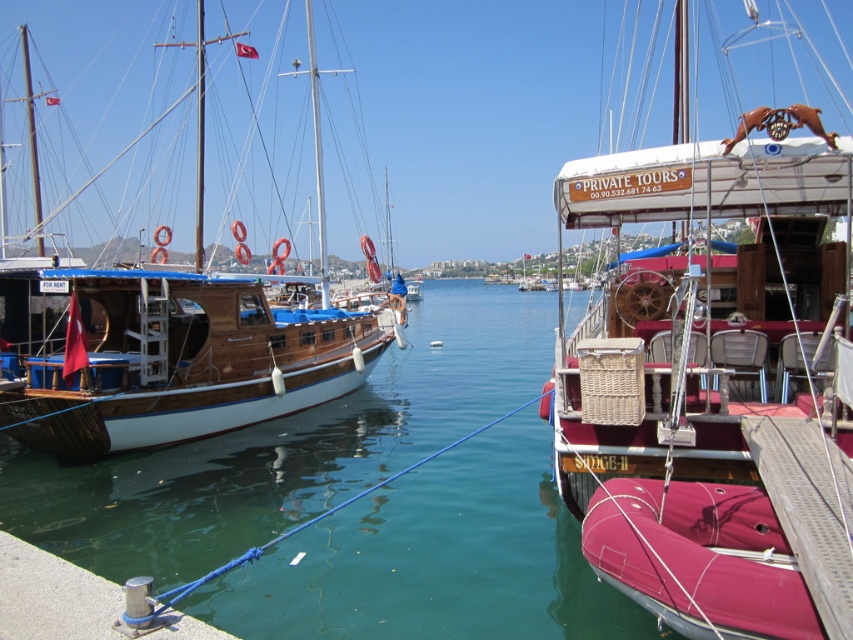
Between wooden sailboat at center and green water at center, which one has less height?

With less height is green water at center.

Does wooden sailboat at center appear under green water at center?

Actually, wooden sailboat at center is above green water at center.

The width and height of the screenshot is (853, 640). Describe the element at coordinates (714, 378) in the screenshot. I see `wooden sailboat at center` at that location.

The height and width of the screenshot is (640, 853). I want to click on wooden sailboat at center, so click(714, 378).

How much distance is there between wooden sailboat at center and wooden sailboat at left?

wooden sailboat at center and wooden sailboat at left are 8.52 meters apart from each other.

Find the location of a particular element. wooden sailboat at center is located at coordinates (714, 378).

Which is behind, point (828, 387) or point (206, 316)?

Point (206, 316)

At what (x,y) coordinates should I click in order to perform the action: click on wooden sailboat at center. Please return your answer as a coordinate pair (x, y). Image resolution: width=853 pixels, height=640 pixels. Looking at the image, I should click on (714, 378).

Is green water at center positioned behind wooden sailboat at left?

No, it is in front of wooden sailboat at left.

Is green water at center above wooden sailboat at left?

Incorrect, green water at center is not positioned above wooden sailboat at left.

Is point (463, 428) more distant than point (204, 369)?

Yes, point (463, 428) is behind point (204, 369).

The height and width of the screenshot is (640, 853). Find the location of `green water at center`. green water at center is located at coordinates (286, 448).